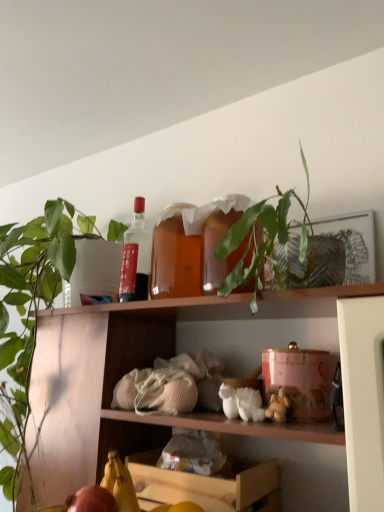
Question: From the image's perspective, is green leafy plant at upper center under yellow matte banana at lower left?

Choices:
 (A) yes
 (B) no

Answer: (B)

Question: Considering the relative positions of green leafy plant at upper center and yellow matte banana at lower left in the image provided, is green leafy plant at upper center to the left of yellow matte banana at lower left from the viewer's perspective?

Choices:
 (A) no
 (B) yes

Answer: (A)

Question: Is green leafy plant at upper center wider than yellow matte banana at lower left?

Choices:
 (A) yes
 (B) no

Answer: (A)

Question: Is green leafy plant at upper center positioned in front of yellow matte banana at lower left?

Choices:
 (A) yes
 (B) no

Answer: (A)

Question: Can you confirm if green leafy plant at upper center is bigger than yellow matte banana at lower left?

Choices:
 (A) yes
 (B) no

Answer: (A)

Question: Considering their positions, is wooden crate at lower center located in front of or behind green leafy plant at upper center?

Choices:
 (A) behind
 (B) front

Answer: (A)

Question: Considering the positions of wooden crate at lower center and green leafy plant at upper center in the image, is wooden crate at lower center taller or shorter than green leafy plant at upper center?

Choices:
 (A) tall
 (B) short

Answer: (B)

Question: From a real-world perspective, relative to green leafy plant at upper center, is wooden crate at lower center vertically above or below?

Choices:
 (A) above
 (B) below

Answer: (B)

Question: Is wooden crate at lower center to the left or to the right of green leafy plant at upper center in the image?

Choices:
 (A) left
 (B) right

Answer: (A)

Question: Would you say green matte plant at upper left is inside or outside yellow matte banana at lower left?

Choices:
 (A) outside
 (B) inside

Answer: (A)

Question: Considering their positions, is green matte plant at upper left located in front of or behind yellow matte banana at lower left?

Choices:
 (A) behind
 (B) front

Answer: (A)

Question: Considering the positions of green matte plant at upper left and yellow matte banana at lower left in the image, is green matte plant at upper left bigger or smaller than yellow matte banana at lower left?

Choices:
 (A) small
 (B) big

Answer: (B)

Question: Is green matte plant at upper left taller or shorter than yellow matte banana at lower left?

Choices:
 (A) short
 (B) tall

Answer: (B)

Question: In the image, is yellow matte banana at lower left positioned in front of or behind green leafy plant at upper center?

Choices:
 (A) front
 (B) behind

Answer: (B)

Question: From the image's perspective, is yellow matte banana at lower left located above or below green leafy plant at upper center?

Choices:
 (A) above
 (B) below

Answer: (B)